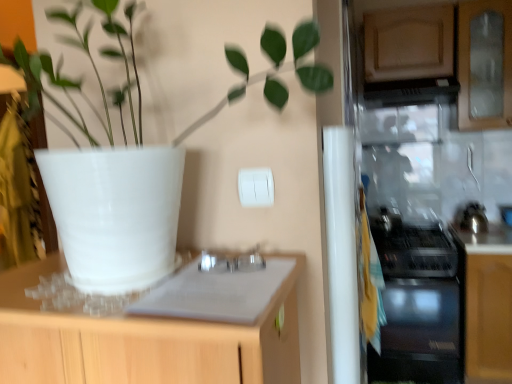
Question: In terms of size, does white matte pot at upper left appear bigger or smaller than black glass gas stove at right?

Choices:
 (A) big
 (B) small

Answer: (A)

Question: From a real-world perspective, is white matte pot at upper left positioned above or below black glass gas stove at right?

Choices:
 (A) above
 (B) below

Answer: (A)

Question: Based on their relative distances, which object is farther from the white matte pot at upper left?

Choices:
 (A) black glass gas stove at right
 (B) satin black oven at lower right
 (C) black glossy exhaust hood at upper right

Answer: (C)

Question: Estimate the real-world distances between objects in this image. Which object is farther from the black glass gas stove at right?

Choices:
 (A) black glossy exhaust hood at upper right
 (B) white matte pot at upper left
 (C) satin black oven at lower right

Answer: (B)